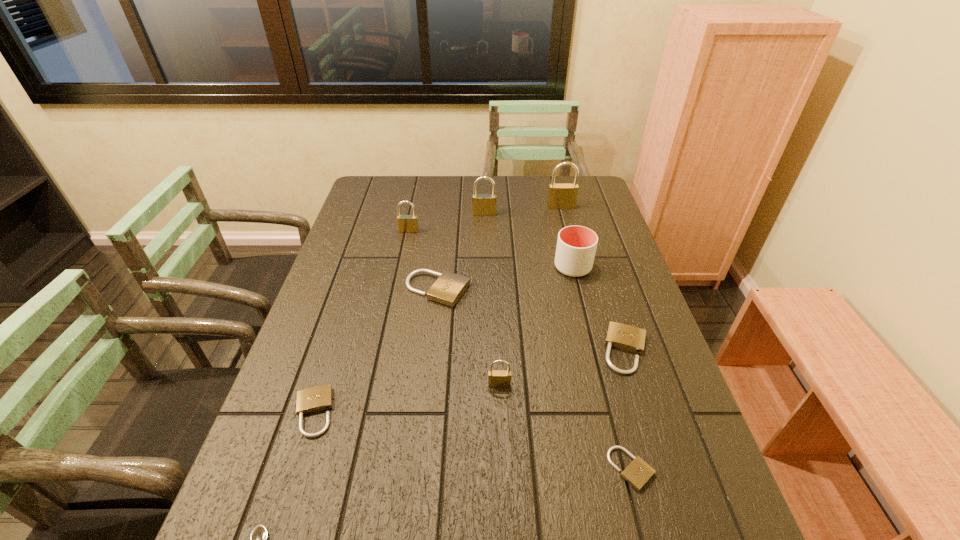
This screenshot has height=540, width=960. What are the coordinates of `the fourth closest beige padlock relative to the sixth shortest object` in the screenshot? It's located at (315, 399).

Select which beige padlock appears as the second closest to the third nearest padlock. Please provide its 2D coordinates. Your answer should be formatted as a tuple, i.e. [(x, y)], where the tuple contains the x and y coordinates of a point satisfying the conditions above.

[(638, 473)]

Identify the location of free region that satisfies the following two spatial constraints: 1. on the back side of the white cup; 2. on the left side of the third shortest object. Image resolution: width=960 pixels, height=540 pixels. point(360,267).